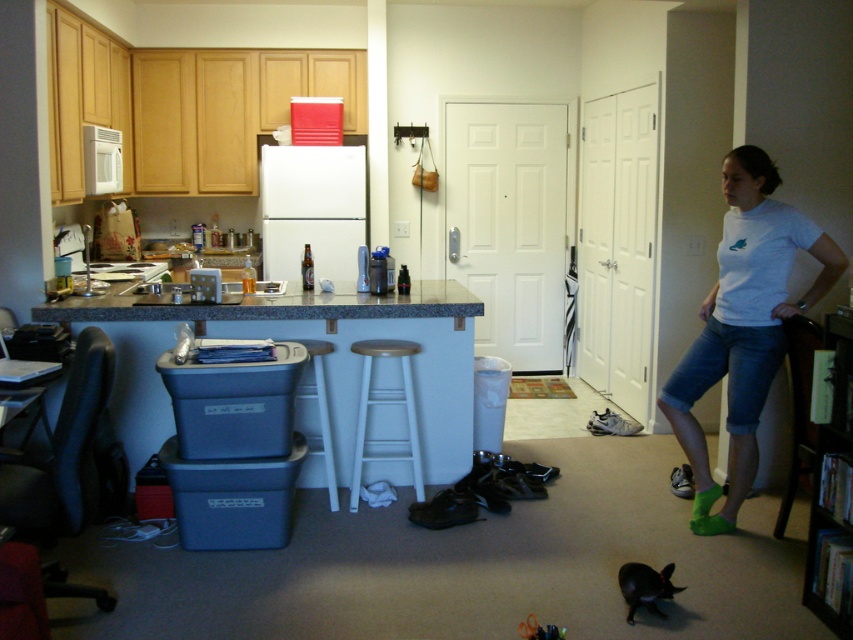
Who is positioned more to the left, white painted wood bar stool at center or white wood bar stool at center?

white wood bar stool at center is more to the left.

Does white painted wood bar stool at center appear under white wood bar stool at center?

No.

Where is `white painted wood bar stool at center`? white painted wood bar stool at center is located at coordinates point(386,403).

Locate an element on the screen. Image resolution: width=853 pixels, height=640 pixels. white painted wood bar stool at center is located at coordinates (386, 403).

Which is above, white t-shirt at right or white wood bar stool at center?

white t-shirt at right is higher up.

Does white t-shirt at right appear over white wood bar stool at center?

Yes.

Is point (735, 417) positioned before point (322, 429)?

Yes, point (735, 417) is in front of point (322, 429).

Where is `white t-shirt at right`? white t-shirt at right is located at coordinates (743, 326).

Is white t-shirt at right thinner than white painted wood bar stool at center?

Incorrect, white t-shirt at right's width is not less than white painted wood bar stool at center's.

Find the location of `white t-shirt at right`. white t-shirt at right is located at coordinates (743, 326).